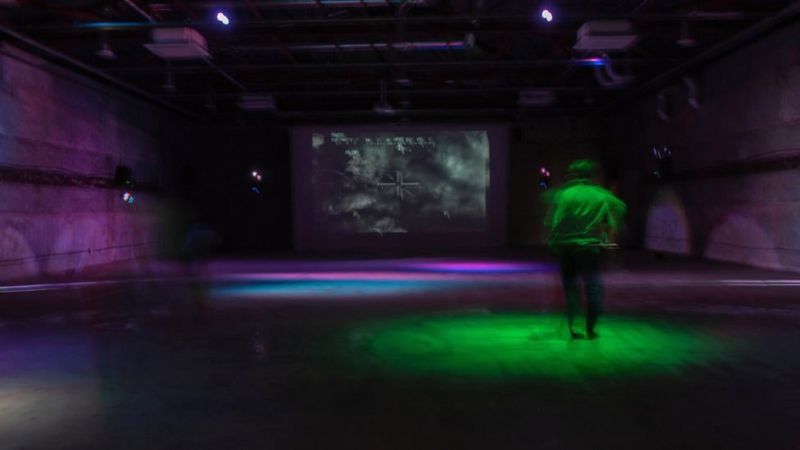
Identify the location of floor. This screenshot has height=450, width=800. (558, 366).